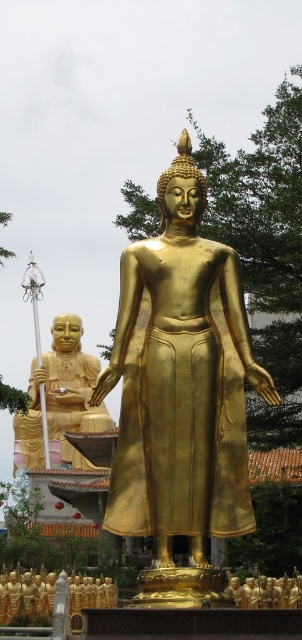
Find the location of a particular element. gold polished statue at left is located at coordinates (60, 401).

From the picture: Is gold polished statue at left smaller than gold metallic statue at lower center?

Incorrect, gold polished statue at left is not smaller in size than gold metallic statue at lower center.

Does point (16, 422) lie behind point (301, 605)?

That is True.

At what (x,y) coordinates should I click in order to perform the action: click on gold polished statue at left. Please return your answer as a coordinate pair (x, y). The image size is (302, 640). Looking at the image, I should click on (60, 401).

Based on the photo, who is positioned more to the right, gold polished statue at center or gold metallic statue at lower center?

Positioned to the right is gold metallic statue at lower center.

Who is higher up, gold polished statue at center or gold metallic statue at lower center?

gold polished statue at center

Is point (141, 346) farther from camera compared to point (295, 589)?

No, it is not.

The image size is (302, 640). In order to click on gold polished statue at center in this screenshot , I will do `click(180, 380)`.

Is gold polished statue at center shorter than gold polished statue at left?

Indeed, gold polished statue at center has a lesser height compared to gold polished statue at left.

Where is `gold polished statue at center`? gold polished statue at center is located at coordinates (180, 380).